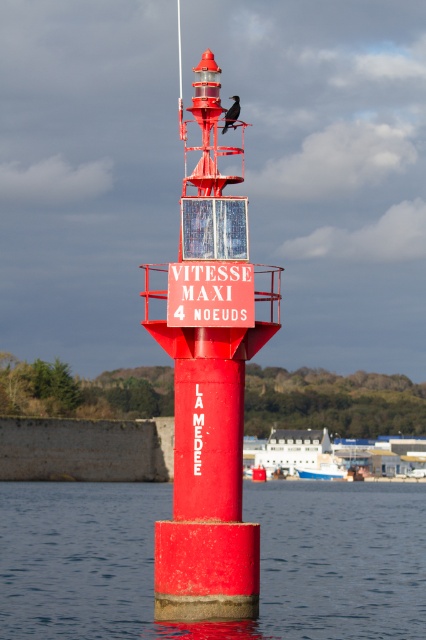
Between smooth concrete water at center and matte red buoy at center, which one appears on the right side from the viewer's perspective?

matte red buoy at center

Identify the location of smooth concrete water at center. (261, 561).

This screenshot has width=426, height=640. In order to click on smooth concrete water at center in this screenshot , I will do `click(261, 561)`.